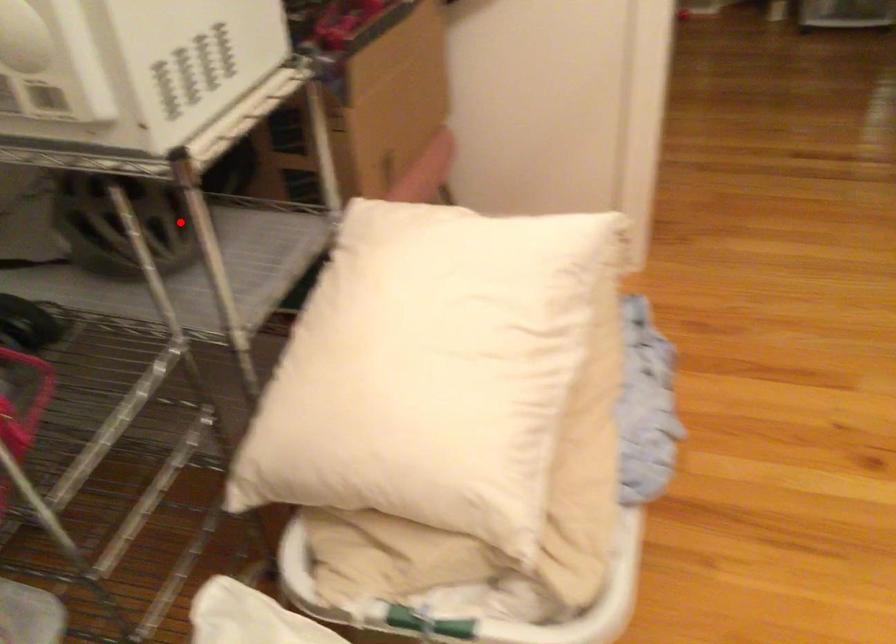
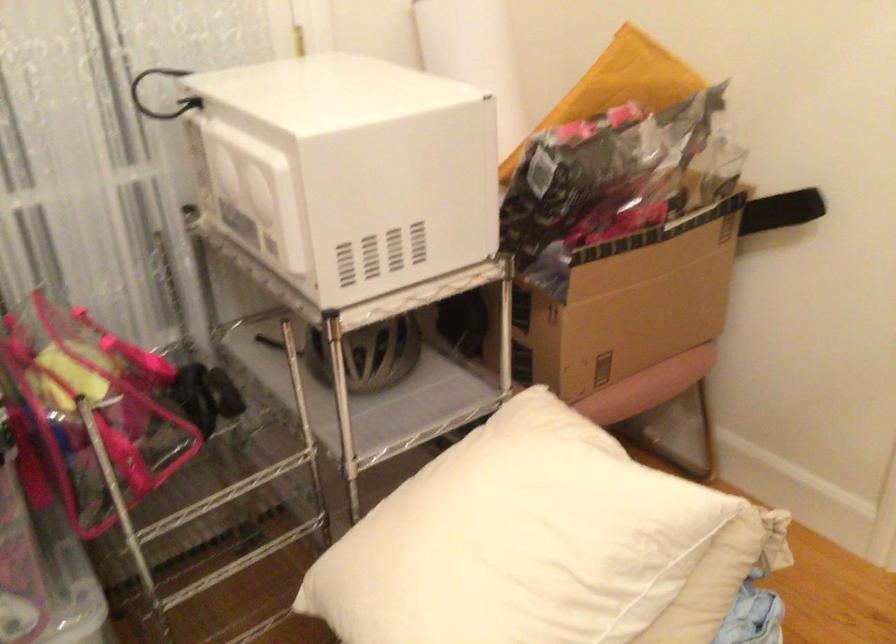
Question: A red point is marked in image1. In image2, is the corresponding 3D point closer to the camera or farther? Reply with the corresponding letter.

Choices:
 (A) The corresponding 3D point is closer.
 (B) The corresponding 3D point is farther.

Answer: (B)